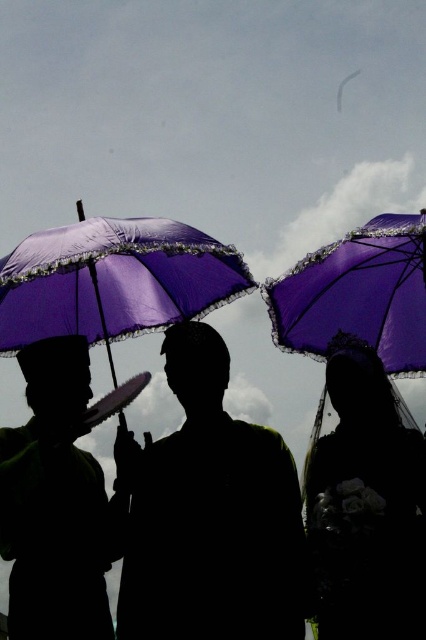
Can you confirm if silhouette umbrella at center is positioned to the right of purple satin umbrella at left?

Correct, you'll find silhouette umbrella at center to the right of purple satin umbrella at left.

Between silhouette umbrella at center and purple satin umbrella at left, which one has less height?

purple satin umbrella at left

Is point (141, 573) closer to viewer compared to point (149, 296)?

That is True.

Find the location of `silhouette umbrella at center`. silhouette umbrella at center is located at coordinates (210, 515).

Measure the distance from purple satin umbrella at left to purple lace umbrella at upper right.

purple satin umbrella at left is 12.20 meters away from purple lace umbrella at upper right.

Find the location of `purple satin umbrella at left`. purple satin umbrella at left is located at coordinates (114, 280).

Between point (238, 566) and point (374, 324), which one is positioned behind?

The point (374, 324) is behind.

Who is more forward, [127,566] or [340,256]?

Point [340,256] is in front.

Identify the location of silhouette umbrella at center. (210, 515).